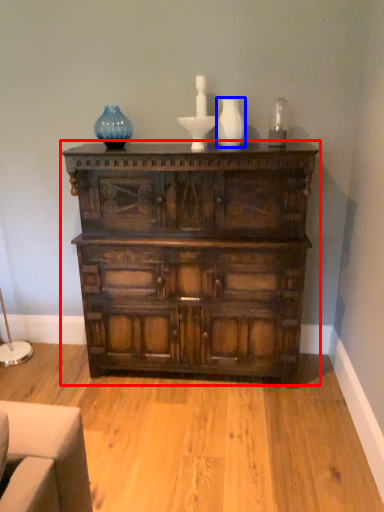
Question: Among these objects, which one is farthest to the camera, chest of drawers (highlighted by a red box) or vase (highlighted by a blue box)?

Choices:
 (A) chest of drawers
 (B) vase

Answer: (B)